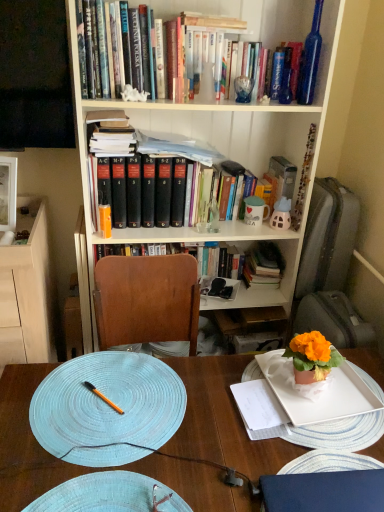
Find the location of a particular element. The height and width of the screenshot is (512, 384). vacant area on the back side of white paper notebook at center is located at coordinates (244, 372).